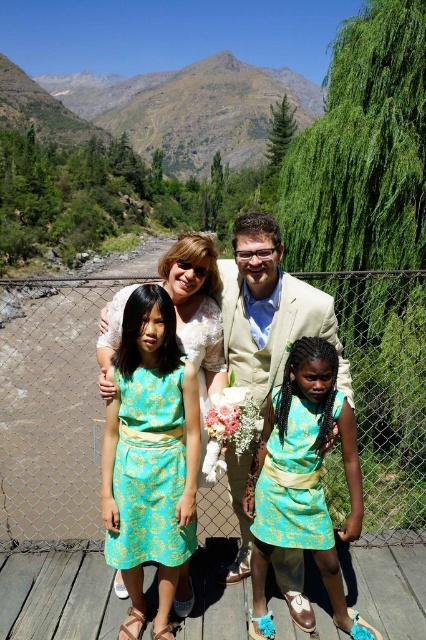
Can you confirm if turquoise brocade dress at center is positioned below teal brocade dress at center?

Actually, turquoise brocade dress at center is above teal brocade dress at center.

Between point (127, 516) and point (342, 428), which one is positioned in front?

Point (342, 428) is more forward.

The width and height of the screenshot is (426, 640). I want to click on turquoise brocade dress at center, so click(149, 456).

Which is more to the right, turquoise brocade dress at center or light beige suit at center?

light beige suit at center is more to the right.

Is point (163, 531) closer to camera compared to point (256, 237)?

Yes, it is in front of point (256, 237).

Who is more forward, (137, 528) or (279, 285)?

Point (137, 528) is in front.

The width and height of the screenshot is (426, 640). Find the location of `turquoise brocade dress at center`. turquoise brocade dress at center is located at coordinates (149, 456).

Is turquoise brocade dress at center to the right of teal floral dress at center from the viewer's perspective?

Incorrect, turquoise brocade dress at center is not on the right side of teal floral dress at center.

Does turquoise brocade dress at center lie behind teal floral dress at center?

No, turquoise brocade dress at center is closer to the viewer.

Identify the location of turquoise brocade dress at center. (149, 456).

The height and width of the screenshot is (640, 426). In order to click on turquoise brocade dress at center in this screenshot , I will do `click(149, 456)`.